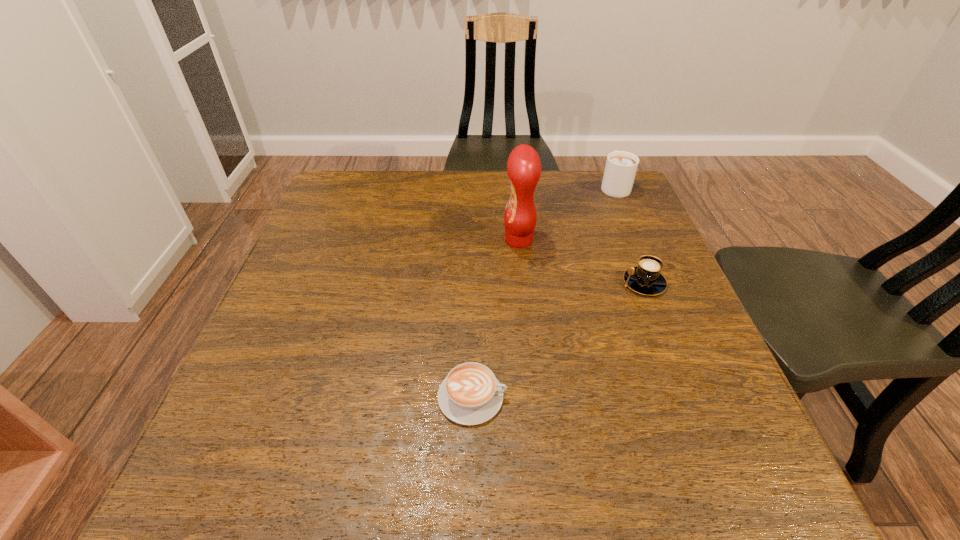
Locate an element on the screen. This screenshot has width=960, height=540. vacant point at the far right corner is located at coordinates (586, 206).

The width and height of the screenshot is (960, 540). In order to click on vacant area that lies between the tallest cappuccino and the second shortest cappuccino in this screenshot , I will do `click(629, 234)`.

The image size is (960, 540). Find the location of `vacant region between the farthest object and the nearest object`. vacant region between the farthest object and the nearest object is located at coordinates (543, 292).

The image size is (960, 540). What are the coordinates of `empty space between the shortest cappuccino and the tallest object` in the screenshot? It's located at (495, 319).

Where is `vacant area that lies between the farthest cappuccino and the second object from left to right`? vacant area that lies between the farthest cappuccino and the second object from left to right is located at coordinates (566, 213).

Locate an element on the screen. vacant point located between the shortest cappuccino and the second farthest cappuccino is located at coordinates (558, 340).

At what (x,y) coordinates should I click in order to perform the action: click on free space between the third object from right to left and the shortest cappuccino. Please return your answer as a coordinate pair (x, y). This screenshot has width=960, height=540. Looking at the image, I should click on (495, 319).

You are a GUI agent. You are given a task and a screenshot of the screen. Output one action in this format:
    pyautogui.click(x=<x>, y=<y>)
    Task: Click on the empty space that is in between the tallest object and the shortest cappuccino
    Image resolution: width=960 pixels, height=540 pixels.
    Given the screenshot: What is the action you would take?
    pyautogui.click(x=495, y=319)

Where is `vacant space in between the third object from right to left and the third shortest object`? The height and width of the screenshot is (540, 960). vacant space in between the third object from right to left and the third shortest object is located at coordinates (566, 213).

Where is `free spot between the condiment and the second tallest object`? free spot between the condiment and the second tallest object is located at coordinates (566, 213).